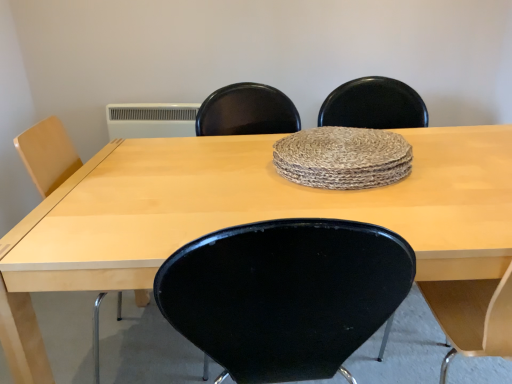
You are a GUI agent. You are given a task and a screenshot of the screen. Output one action in this format:
    pyautogui.click(x=<x>, y=<y>)
    Task: Click on the vacant area that is in front of natural fiber placemat at center
    The width and height of the screenshot is (512, 384).
    Given the screenshot: What is the action you would take?
    click(x=381, y=214)